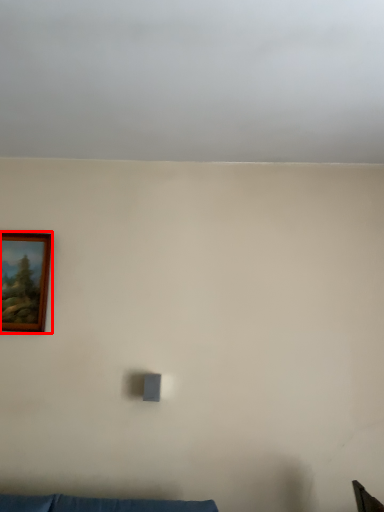
Question: From the image's perspective, what is the correct spatial positioning of picture frame (annotated by the red box) in reference to cloud?

Choices:
 (A) below
 (B) above

Answer: (A)